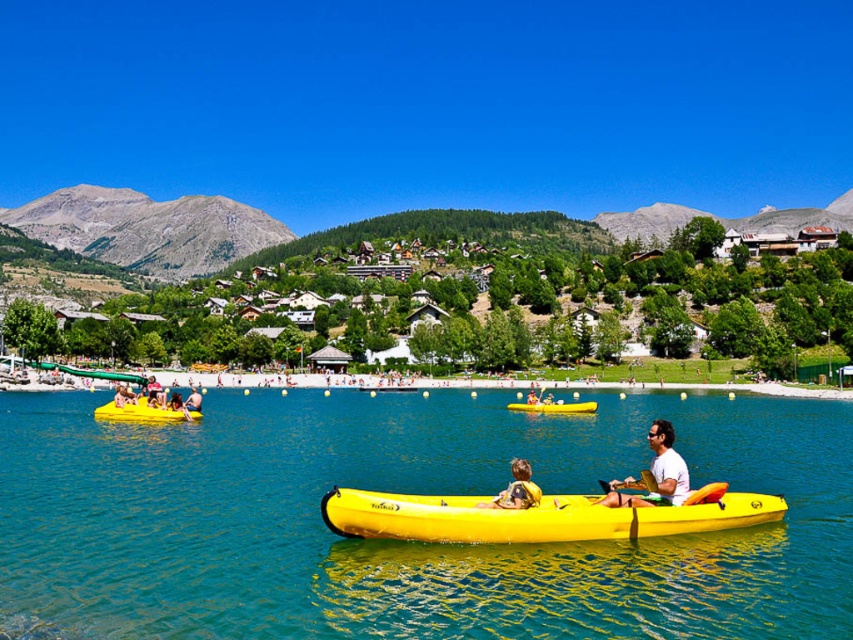
You are planning to launch a small boat from the lakeside dock. According to the image, where is the yellow rubber boat at center positioned relative to the dock?

The yellow rubber boat at center is located at point coordinates (405, 541), which places it slightly to the right and above the dock area in the image.